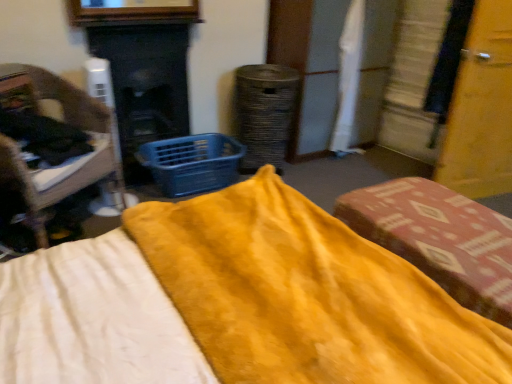
This screenshot has width=512, height=384. In order to click on free point above velvet yellow cushion at center, which is the 2th furniture from left to right (from a real-world perspective) in this screenshot , I will do `click(446, 216)`.